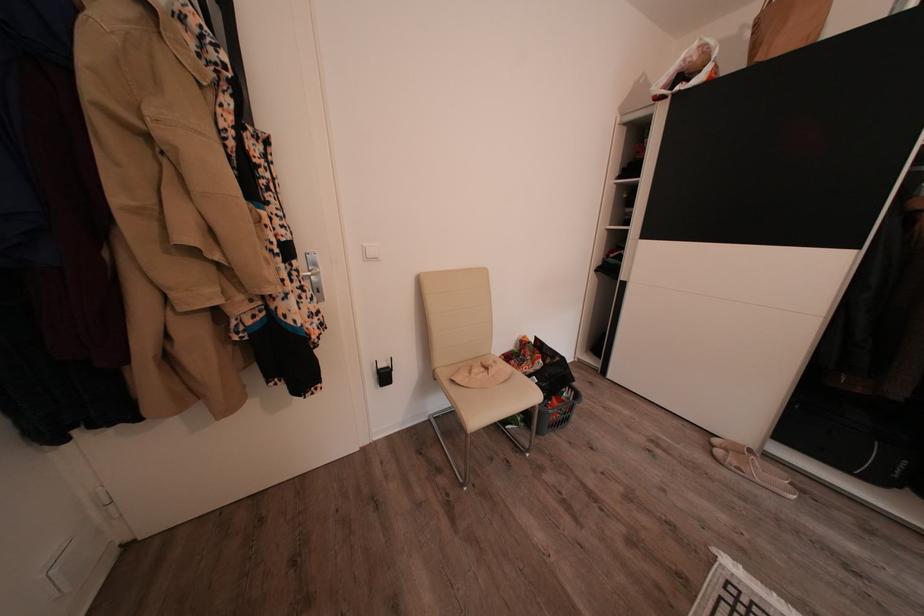
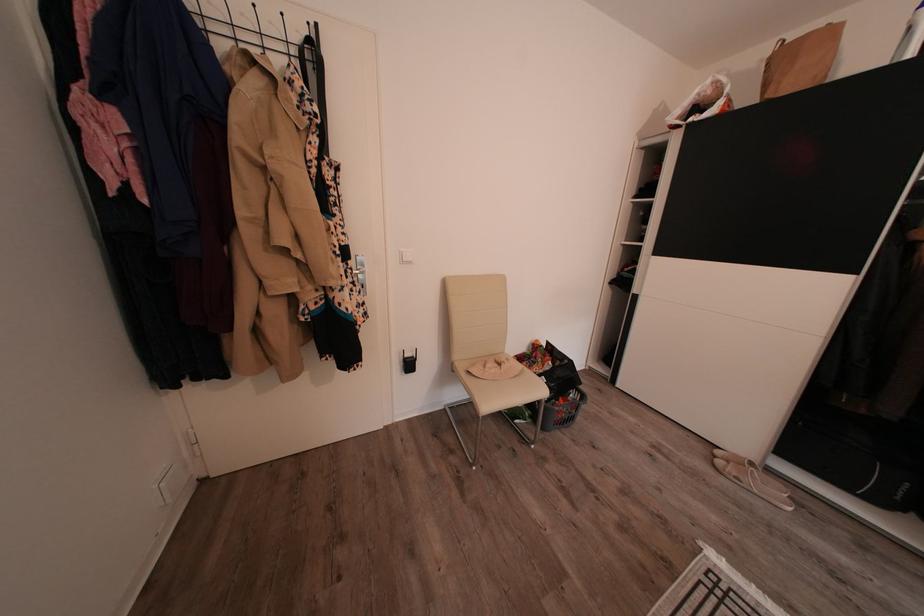
In the second image, find the point that corresponds to (x=560, y=405) in the first image.

(565, 405)